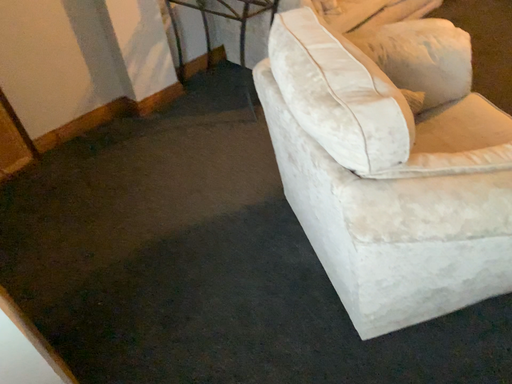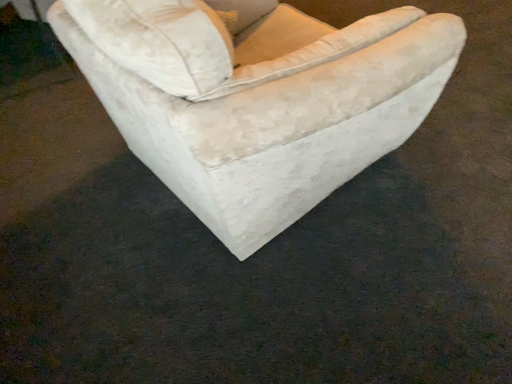
Question: How did the camera likely rotate when shooting the video?

Choices:
 (A) rotated left
 (B) rotated right

Answer: (B)